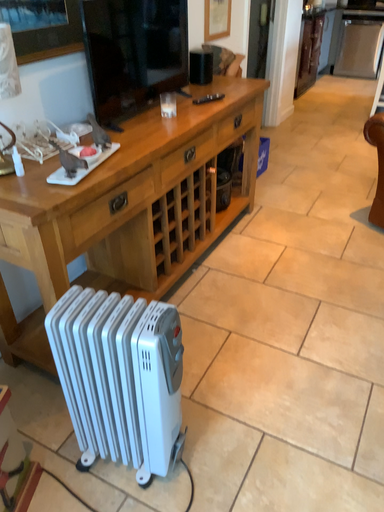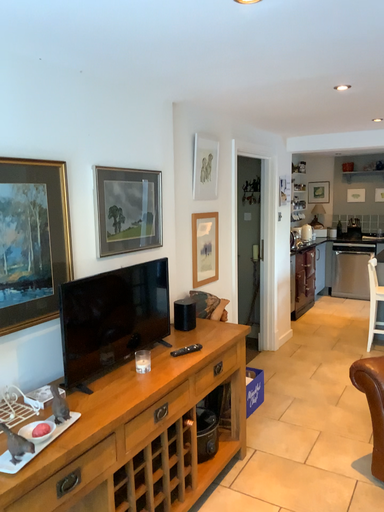
Question: Which way did the camera rotate in the video?

Choices:
 (A) rotated upward
 (B) rotated downward

Answer: (A)